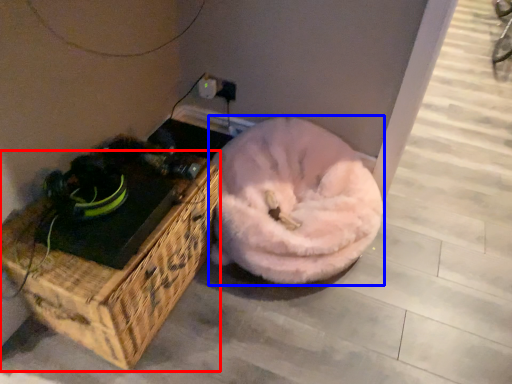
Question: Which object appears farthest to the camera in this image, furniture (highlighted by a red box) or dog bed (highlighted by a blue box)?

Choices:
 (A) furniture
 (B) dog bed

Answer: (B)